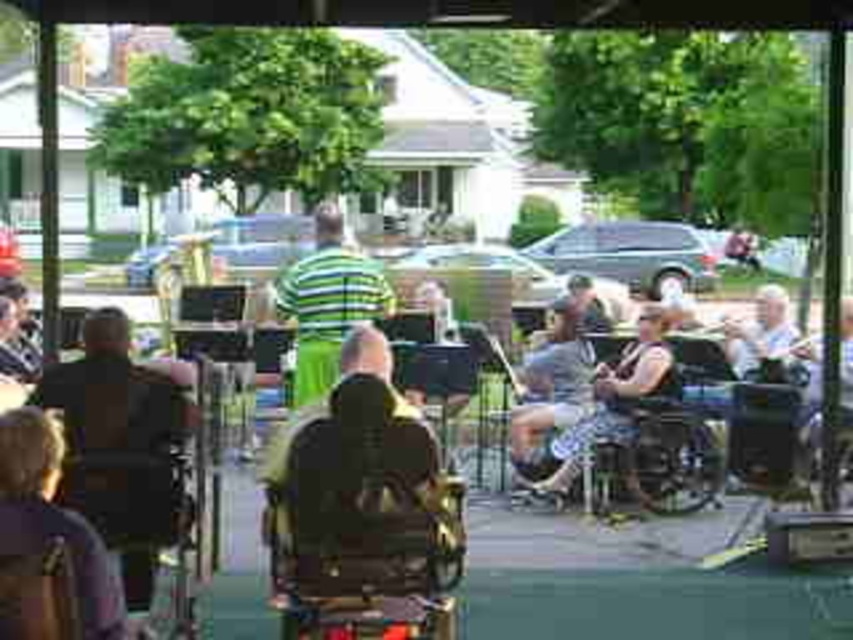
Question: Is dark brown leather jacket at lower left positioned behind camouflage shorts at center?

Choices:
 (A) no
 (B) yes

Answer: (A)

Question: Which of these objects is positioned farthest from the dark brown leather jacket at lower left?

Choices:
 (A) camouflage-patterned shorts at center
 (B) dark brown leather wheelchair at center

Answer: (A)

Question: Is dark brown leather jacket at lower left in front of camouflage-patterned shorts at center?

Choices:
 (A) yes
 (B) no

Answer: (A)

Question: Among these objects, which one is farthest from the camera?

Choices:
 (A) dark brown leather jacket at left
 (B) dark brown leather jacket at lower left
 (C) camouflage-patterned shorts at center

Answer: (C)

Question: Can you confirm if dark brown leather wheelchair at center is wider than camouflage-patterned shorts at center?

Choices:
 (A) yes
 (B) no

Answer: (B)

Question: Which object is closer to the camera taking this photo?

Choices:
 (A) dark brown leather wheelchair at center
 (B) green striped shirt at center
 (C) dark brown leather jacket at left

Answer: (A)